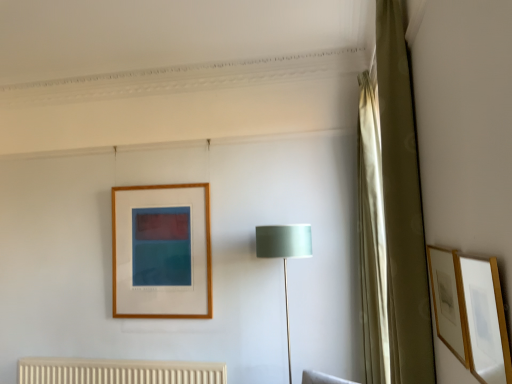
Question: From the image's perspective, is matte gold picture frame at right, which is the 1th picture frame from front to back, located above or below satin green fabric at center?

Choices:
 (A) above
 (B) below

Answer: (A)

Question: Considering the positions of point (485, 336) and point (307, 249), is point (485, 336) closer or farther from the camera than point (307, 249)?

Choices:
 (A) farther
 (B) closer

Answer: (B)

Question: Estimate the real-world distances between objects in this image. Which object is closer to the satin green fabric at center?

Choices:
 (A) wooden picture frame at right, the 1th picture frame in the back-to-front sequence
 (B) green fabric curtain at right, positioned as the 2th curtain in back-to-front order
 (C) matte gold picture frame at right, which is the 1th picture frame from front to back
 (D) silky gold curtain at right, which is counted as the first curtain, starting from the back

Answer: (B)

Question: Based on their relative distances, which object is nearer to the green fabric curtain at right, the first curtain viewed from the front?

Choices:
 (A) wooden picture frame at right, the 1th picture frame in the back-to-front sequence
 (B) matte gold picture frame at right, which is the 1th picture frame from front to back
 (C) satin green fabric at center
 (D) silky gold curtain at right, acting as the 2th curtain starting from the front

Answer: (D)